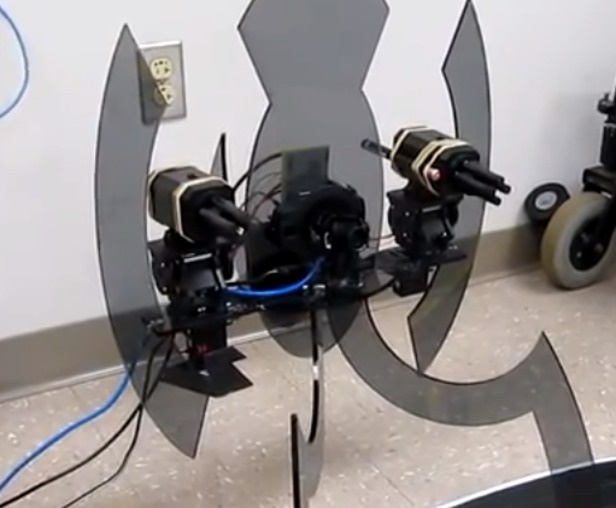
Locate an element on the screen. The height and width of the screenshot is (508, 616). wall power/electrical outlet is located at coordinates (164, 66), (171, 95).